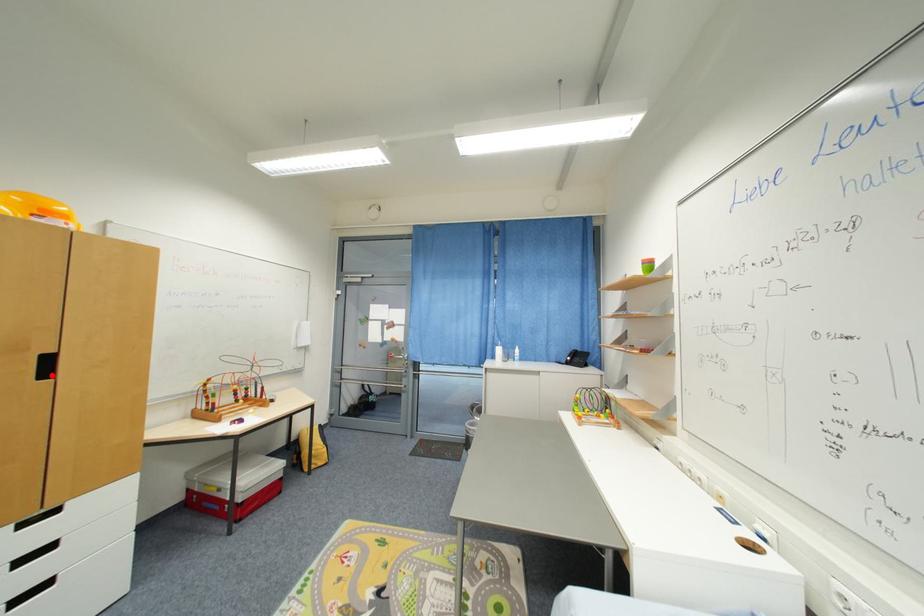
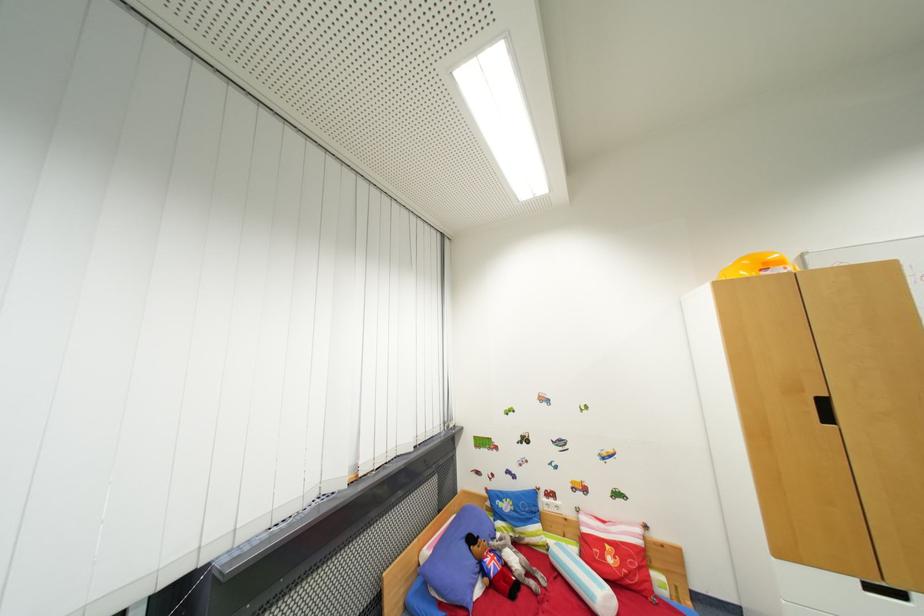
Question: I am providing you with two images of the same scene from different viewpoints. Given a red point in image1, look at the same physical point in image2. Is it:

Choices:
 (A) Closer to the viewpoint
 (B) Farther from the viewpoint

Answer: (A)